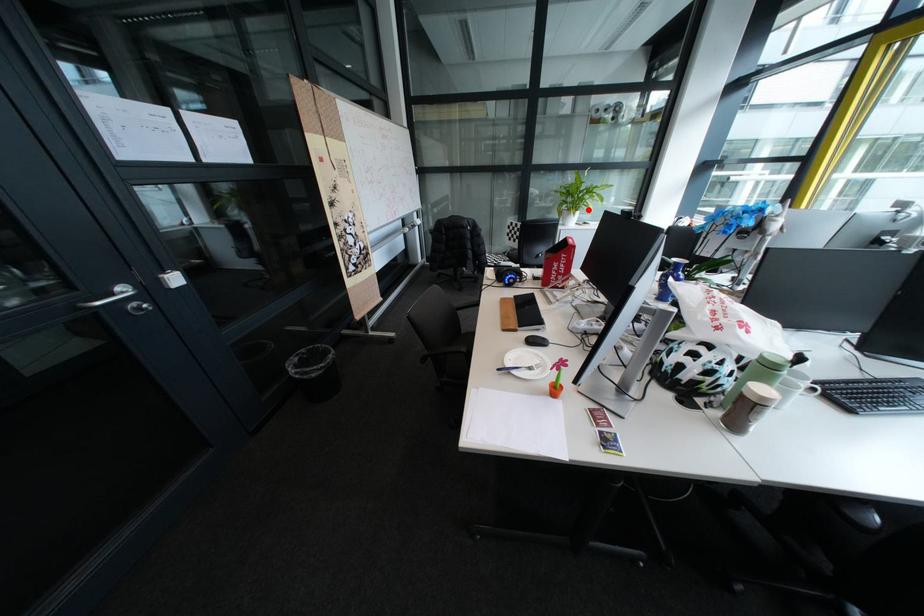
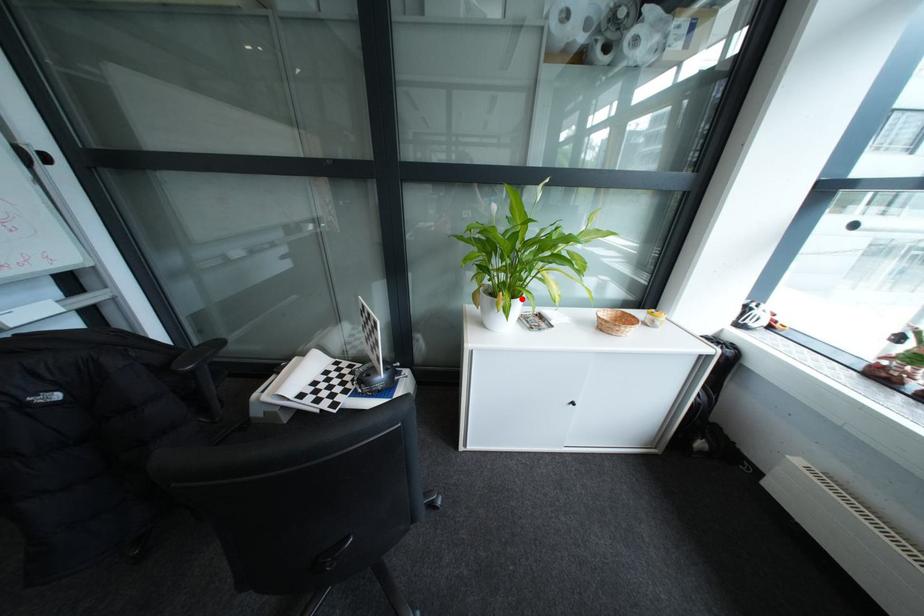
I am providing you with two images of the same scene from different viewpoints. A red point is marked on the first image and another point is marked on the second image. Do the highlighted points in image1 and image2 indicate the same real-world spot?

Yes